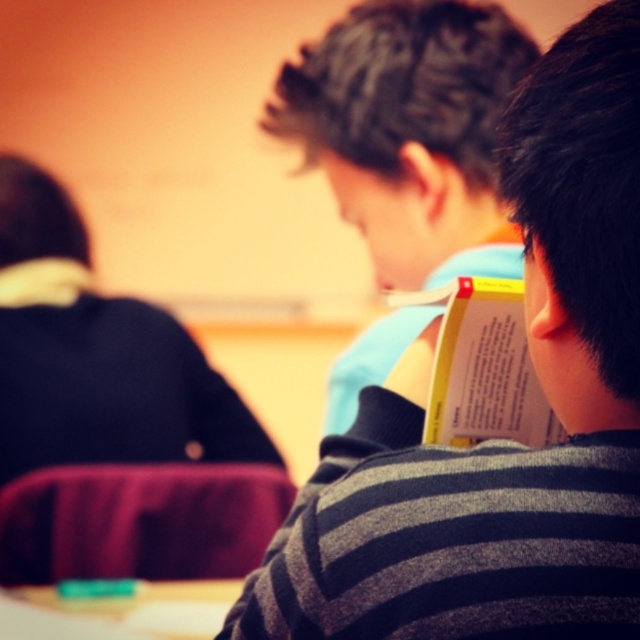
Question: Among these objects, which one is nearest to the camera?

Choices:
 (A) striped sweater at center
 (B) dark blue sweater at left
 (C) green plastic eraser at lower left
 (D) yellow paper book at center

Answer: (A)

Question: Estimate the real-world distances between objects in this image. Which object is closer to the dark blue sweater at left?

Choices:
 (A) striped sweater at center
 (B) yellow paper book at center

Answer: (B)

Question: Does yellow paper book at center come in front of green plastic eraser at lower left?

Choices:
 (A) yes
 (B) no

Answer: (A)

Question: Which object is closer to the camera taking this photo?

Choices:
 (A) striped sweater at center
 (B) yellow paper book at center
 (C) green plastic eraser at lower left

Answer: (A)

Question: Does yellow paper book at center come behind green plastic eraser at lower left?

Choices:
 (A) yes
 (B) no

Answer: (B)

Question: Is striped sweater at center further to the viewer compared to green plastic eraser at lower left?

Choices:
 (A) no
 (B) yes

Answer: (A)